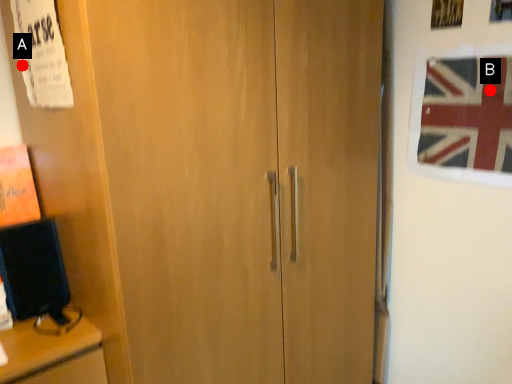
Question: Two points are circled on the image, labeled by A and B beside each circle. Which of the following is the farthest from the observer?

Choices:
 (A) A is further
 (B) B is further

Answer: (B)